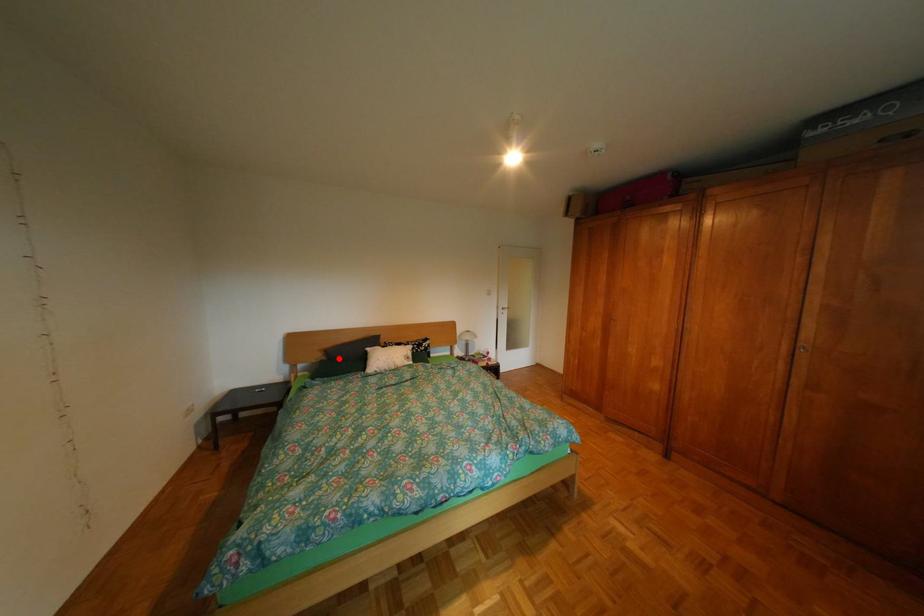
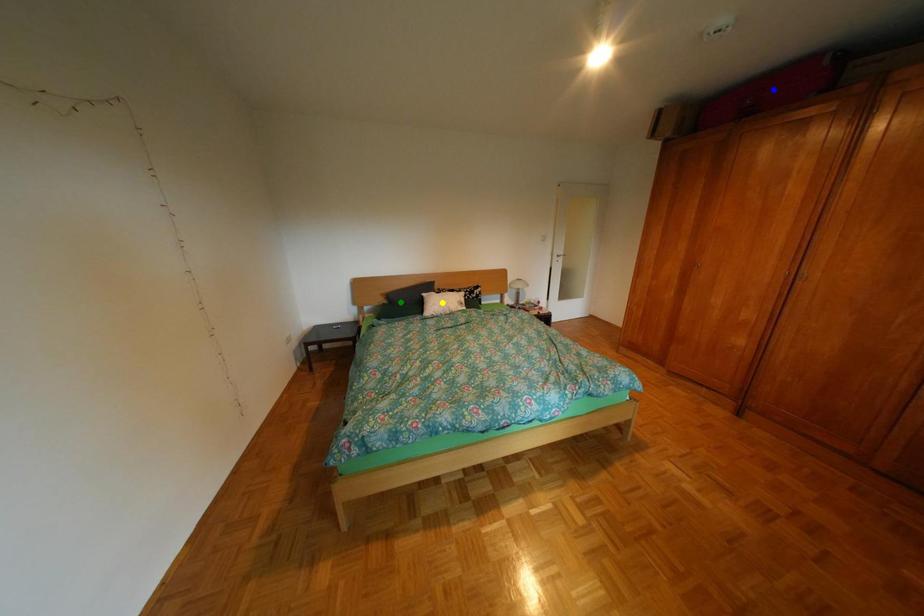
Question: I am providing you with two images of the same scene from different viewpoints. A red point is marked on the first image. You are given multiple points on the second image. Which point in image 2 represents the same 3d spot as the red point in image 1?

Choices:
 (A) blue point
 (B) yellow point
 (C) green point

Answer: (C)